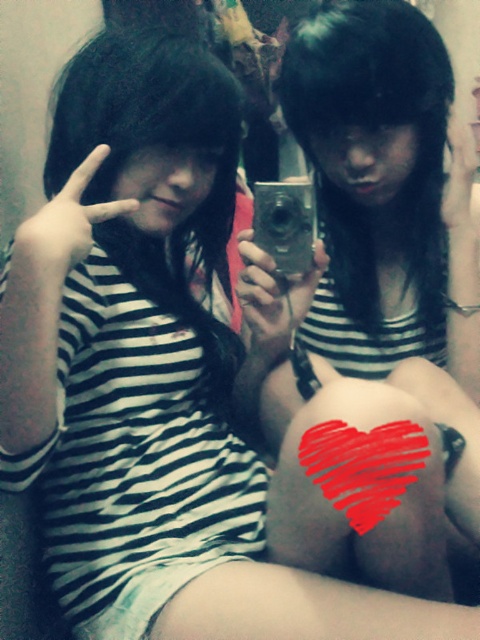
Question: Which point appears closest to the camera in this image?

Choices:
 (A) (447, 100)
 (B) (385, 506)

Answer: (B)

Question: Which of the following is the closest to the observer?

Choices:
 (A) red painted heart at center
 (B) matte black camera at center

Answer: (A)

Question: Does matte black camera at center appear on the left side of red painted heart at center?

Choices:
 (A) no
 (B) yes

Answer: (A)

Question: Which point is closer to the camera?

Choices:
 (A) red painted heart at center
 (B) matte black camera at center

Answer: (A)

Question: From the image, what is the correct spatial relationship of matte black camera at center in relation to red painted heart at center?

Choices:
 (A) above
 (B) below

Answer: (A)

Question: Considering the relative positions of matte black camera at center and red painted heart at center in the image provided, where is matte black camera at center located with respect to red painted heart at center?

Choices:
 (A) below
 (B) above

Answer: (B)